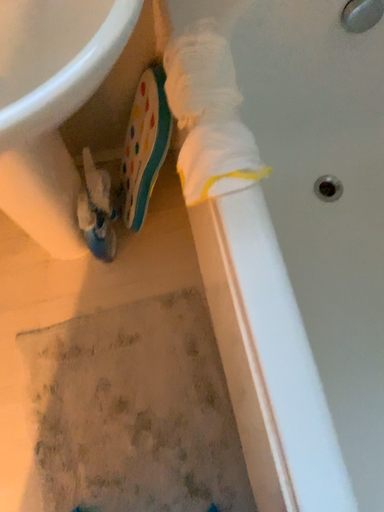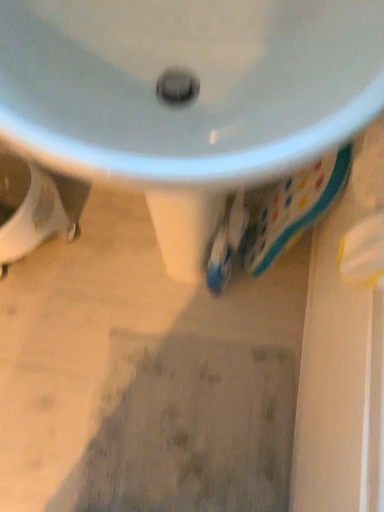
Question: How did the camera likely rotate when shooting the video?

Choices:
 (A) rotated upward
 (B) rotated downward

Answer: (A)